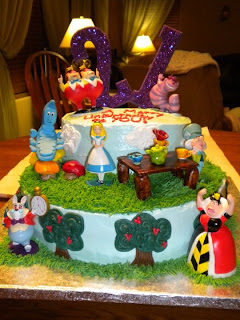
The height and width of the screenshot is (320, 240). I want to click on table, so click(146, 167).